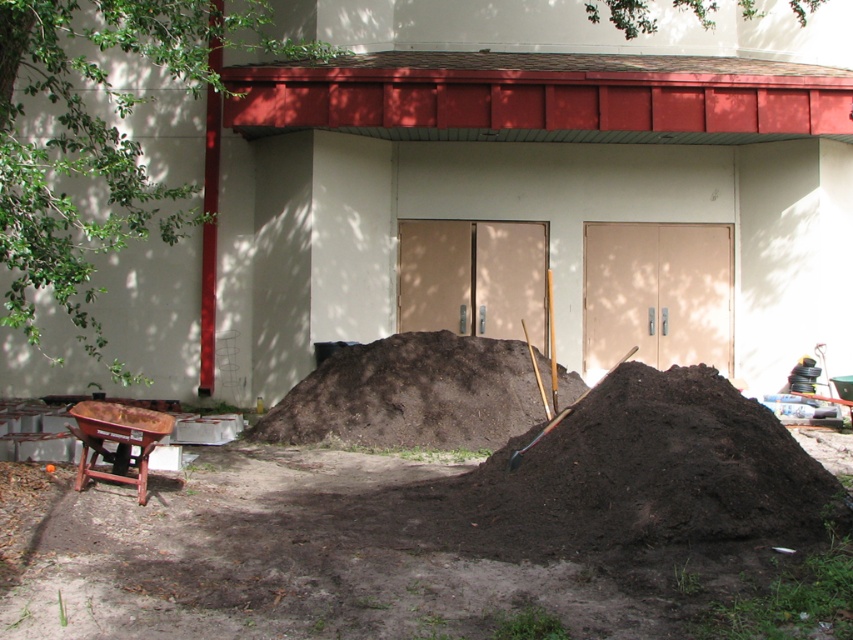
You are a construction worker needing to move the dark brown soil at center to a location 10 meters away. Can you complete this task with one trip using a standard wheelbarrow?

The dark brown soil at center is 9.84 meters away from the target location, so yes, you can complete the task with one trip using a standard wheelbarrow since it is within the typical carrying distance.

You are a construction worker standing in front of the building. You need to grab the metallic silver shovel at center to move the dark brown soil at center. Which object should you move first to reach the shovel?

The dark brown soil at center is closer to you than the metallic silver shovel at center. To reach the shovel, you need to move the dark brown soil at center first.